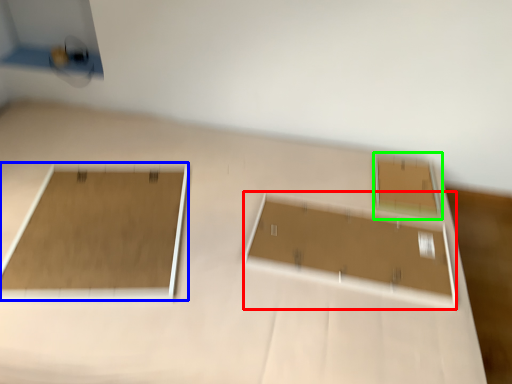
Question: Which object is positioned farthest from rectangle (highlighted by a red box)? Select from rectangle (highlighted by a blue box) and rectangle (highlighted by a green box).

Choices:
 (A) rectangle
 (B) rectangle

Answer: (A)